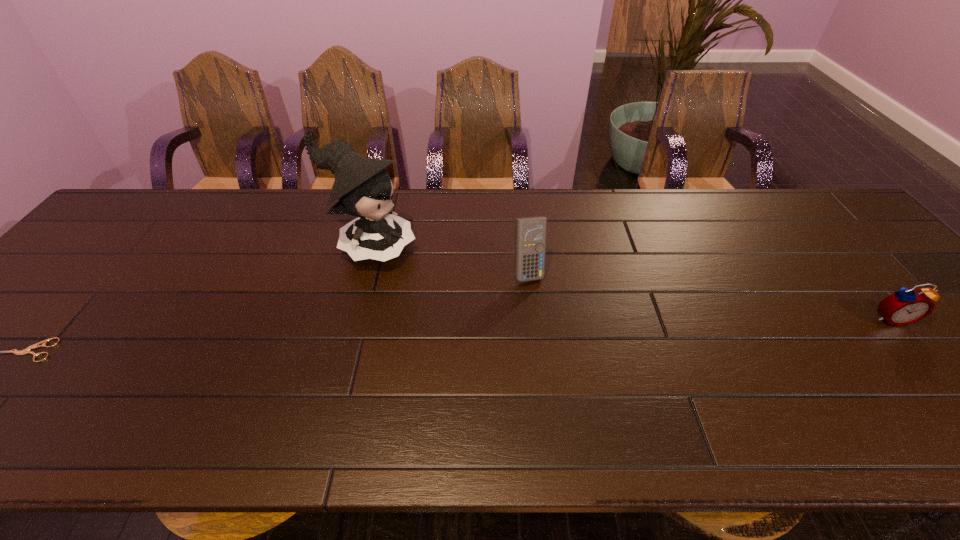
You are a GUI agent. You are given a task and a screenshot of the screen. Output one action in this format:
    pyautogui.click(x=<x>, y=<y>)
    Task: Click on the vacant space located on the front-facing side of the third shortest object
    This screenshot has width=960, height=540.
    Given the screenshot: What is the action you would take?
    pyautogui.click(x=545, y=310)

Image resolution: width=960 pixels, height=540 pixels. In order to click on free space located on the front-facing side of the third shortest object in this screenshot , I will do `click(561, 342)`.

Where is `blank space located 0.330m on the front-facing side of the third shortest object`? blank space located 0.330m on the front-facing side of the third shortest object is located at coordinates (589, 399).

This screenshot has width=960, height=540. I want to click on object that is at the far edge, so click(364, 188).

You are a GUI agent. You are given a task and a screenshot of the screen. Output one action in this format:
    pyautogui.click(x=<x>, y=<y>)
    Task: Click on the object that is at the right edge
    This screenshot has height=540, width=960.
    Given the screenshot: What is the action you would take?
    pyautogui.click(x=905, y=306)

The height and width of the screenshot is (540, 960). In the image, there is a desktop. Find the location of `free space at the far edge`. free space at the far edge is located at coordinates (742, 199).

The width and height of the screenshot is (960, 540). Find the location of `vacant space at the near edge of the desktop`. vacant space at the near edge of the desktop is located at coordinates (79, 391).

You are a GUI agent. You are given a task and a screenshot of the screen. Output one action in this format:
    pyautogui.click(x=<x>, y=<y>)
    Task: Click on the free space at the left edge
    Image resolution: width=960 pixels, height=540 pixels.
    Given the screenshot: What is the action you would take?
    click(x=12, y=357)

Locate an element on the screen. vacant space at the far left corner of the desktop is located at coordinates (149, 224).

The width and height of the screenshot is (960, 540). What are the coordinates of `vacant space at the far right corner` in the screenshot? It's located at [806, 218].